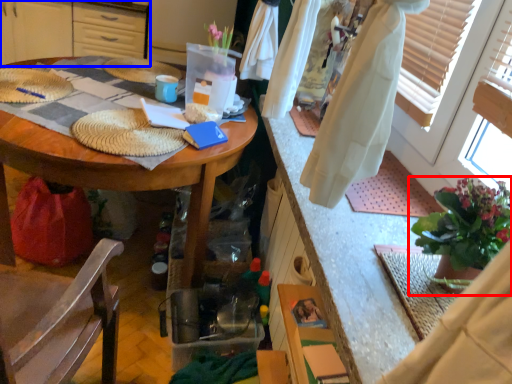
Question: Which object is closer to the camera taking this photo, houseplant (highlighted by a red box) or cabinetry (highlighted by a blue box)?

Choices:
 (A) houseplant
 (B) cabinetry

Answer: (A)